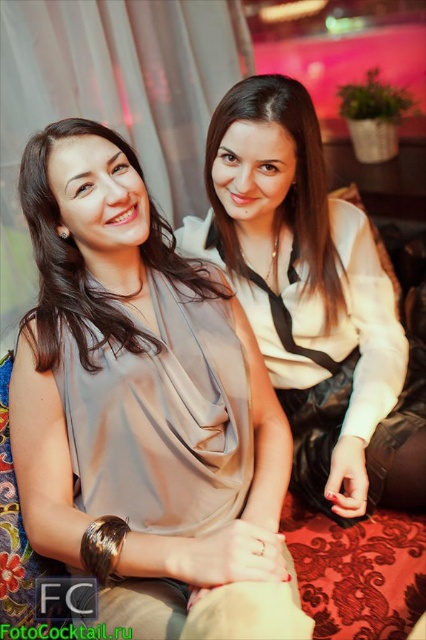
Question: Which point is farther to the camera?

Choices:
 (A) satin beige blouse at left
 (B) satin beige blouse at center
 (C) matte white blouse at center

Answer: (C)

Question: Which point is farther to the camera?

Choices:
 (A) satin beige blouse at center
 (B) matte gray blouse at center

Answer: (A)

Question: Can you confirm if matte gray blouse at center is positioned to the left of matte white blouse at center?

Choices:
 (A) yes
 (B) no

Answer: (A)

Question: Does matte gray blouse at center have a lesser width compared to satin beige blouse at center?

Choices:
 (A) no
 (B) yes

Answer: (B)

Question: Can you confirm if matte gray blouse at center is thinner than satin beige blouse at left?

Choices:
 (A) yes
 (B) no

Answer: (B)

Question: Among these objects, which one is farthest from the camera?

Choices:
 (A) satin beige blouse at center
 (B) matte gray blouse at center
 (C) satin beige blouse at left
 (D) matte white blouse at center

Answer: (D)